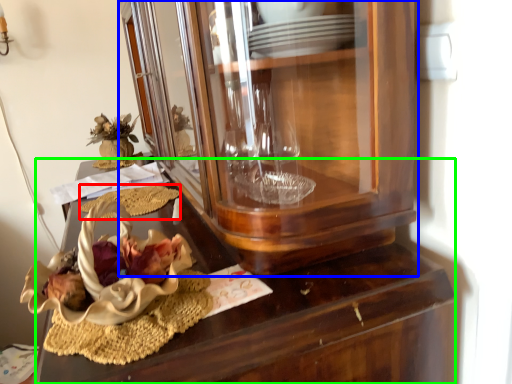
Question: Estimate the real-world distances between objects in this image. Which object is farther from food (highlighted by a red box), cabinetry (highlighted by a blue box) or desk (highlighted by a green box)?

Choices:
 (A) cabinetry
 (B) desk

Answer: (A)